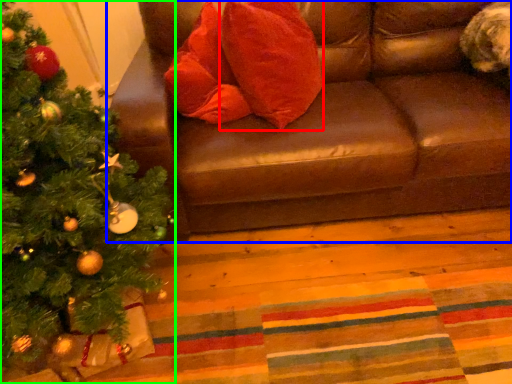
Question: Based on their relative distances, which object is farther from throw pillow (highlighted by a red box)? Choose from studio couch (highlighted by a blue box) and christmas tree (highlighted by a green box).

Choices:
 (A) studio couch
 (B) christmas tree

Answer: (B)